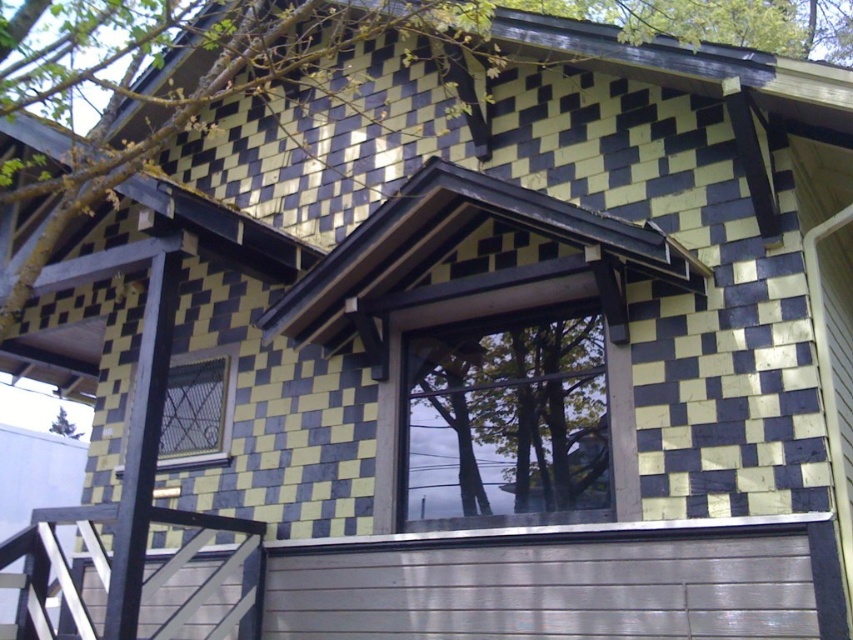
You are standing on the porch of the house and want to enter the garage. The white painted wood garage door at lower center and the wooden balustrade at lower left are in your line of sight. Which object should you approach first to reach the garage entrance?

The white painted wood garage door at lower center is positioned over the wooden balustrade at lower left, so you should approach the white painted wood garage door at lower center first to reach the garage entrance.

You are standing in front of the house and notice a point at coordinates (547, 588). Based on the scene description, what object is located at this point?

The point at coordinates (547, 588) indicates the white painted wood garage door at lower center.